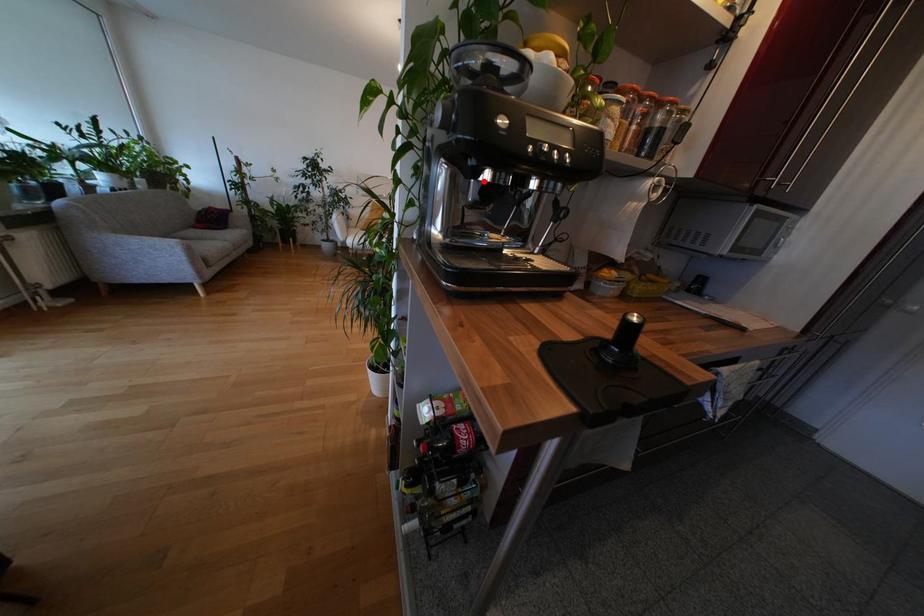
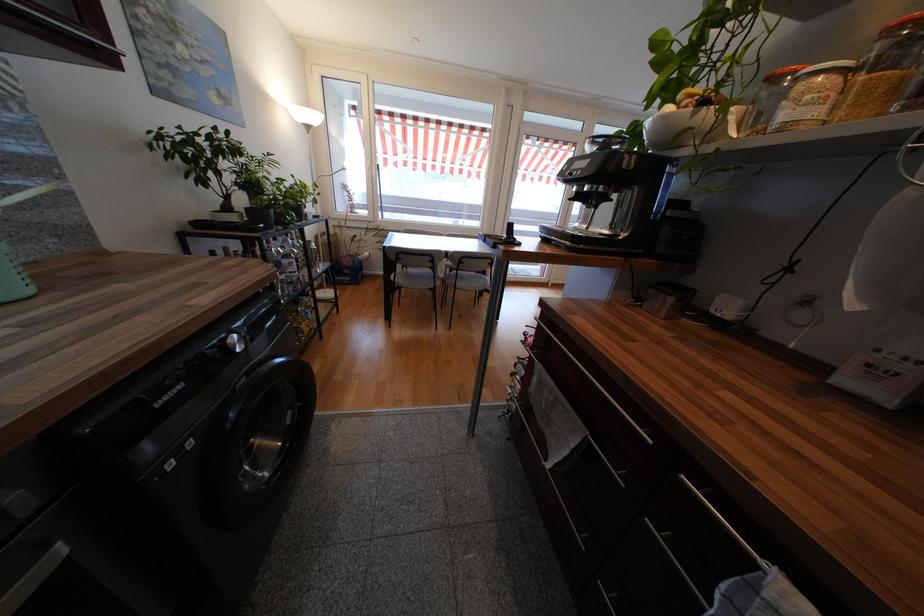
Where in the second image is the point corresponding to the highlighted location from the first image?

(581, 193)